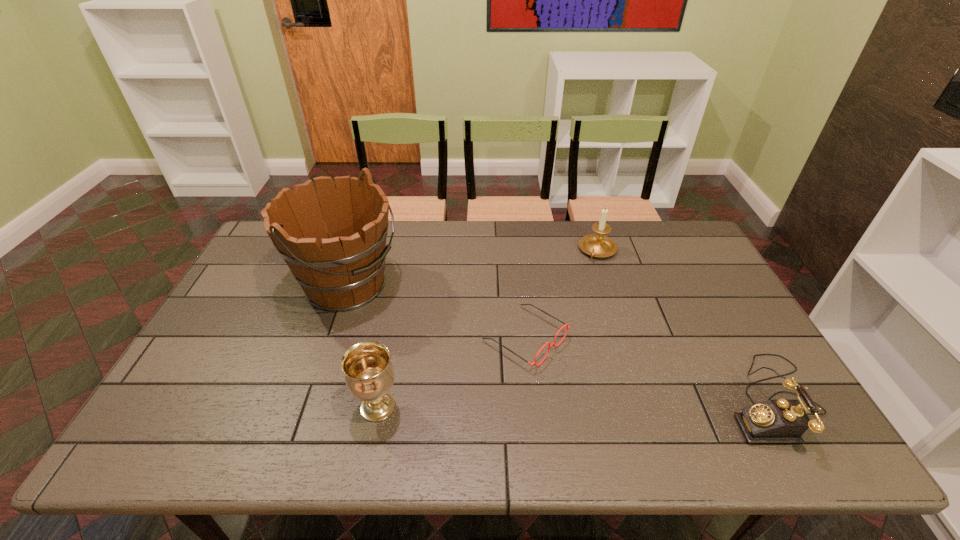
The width and height of the screenshot is (960, 540). What are the coordinates of `wine bucket that is at the far edge` in the screenshot? It's located at (340, 269).

You are a GUI agent. You are given a task and a screenshot of the screen. Output one action in this format:
    pyautogui.click(x=<x>, y=<y>)
    Task: Click on the candle holder that is at the far edge
    
    Given the screenshot: What is the action you would take?
    pyautogui.click(x=597, y=245)

The height and width of the screenshot is (540, 960). I want to click on chalice located at the near edge, so click(369, 375).

The width and height of the screenshot is (960, 540). Identify the location of telephone that is at the near edge. (773, 421).

The image size is (960, 540). I want to click on object at the right edge, so click(x=773, y=421).

You are a GUI agent. You are given a task and a screenshot of the screen. Output one action in this format:
    pyautogui.click(x=<x>, y=<y>)
    Task: Click on the object located at the near right corner
    The image size is (960, 540).
    Given the screenshot: What is the action you would take?
    pyautogui.click(x=773, y=421)

The height and width of the screenshot is (540, 960). Find the location of `blank space at the far edge of the desktop`. blank space at the far edge of the desktop is located at coordinates point(452,248).

This screenshot has width=960, height=540. I want to click on vacant space at the near edge, so click(x=325, y=409).

In the image, there is a desktop. At what (x,y) coordinates should I click in order to perform the action: click on free space at the left edge. Please return your answer as a coordinate pair (x, y). Looking at the image, I should click on (283, 264).

In the image, there is a desktop. At what (x,y) coordinates should I click in order to perform the action: click on free space at the right edge. Please return your answer as a coordinate pair (x, y). Looking at the image, I should click on (740, 346).